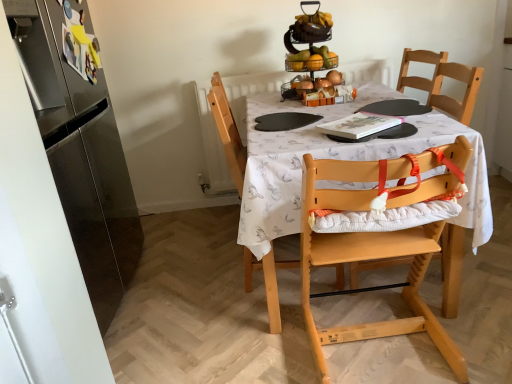
Question: Is light wood highchair at center, which is the second chair in front-to-back order, closer to the viewer compared to light wood highchair at center, positioned as the 2th chair in back-to-front order?

Choices:
 (A) no
 (B) yes

Answer: (A)

Question: Can you confirm if light wood highchair at center, which is the second chair in front-to-back order, is bigger than light wood highchair at center, the first chair in the front-to-back sequence?

Choices:
 (A) no
 (B) yes

Answer: (B)

Question: Considering the relative sizes of light wood highchair at center, the first chair in the back-to-front sequence, and light wood highchair at center, the first chair in the front-to-back sequence, in the image provided, is light wood highchair at center, the first chair in the back-to-front sequence, taller than light wood highchair at center, the first chair in the front-to-back sequence,?

Choices:
 (A) yes
 (B) no

Answer: (A)

Question: From a real-world perspective, is light wood highchair at center, the first chair in the back-to-front sequence, located beneath light wood highchair at center, positioned as the 2th chair in back-to-front order?

Choices:
 (A) yes
 (B) no

Answer: (B)

Question: Does light wood highchair at center, which is the second chair in front-to-back order, appear on the right side of light wood highchair at center, the first chair in the front-to-back sequence?

Choices:
 (A) yes
 (B) no

Answer: (B)

Question: Would you say light wood highchair at center, which is the second chair in front-to-back order, contains light wood highchair at center, positioned as the 2th chair in back-to-front order?

Choices:
 (A) yes
 (B) no

Answer: (B)

Question: Considering the relative sizes of light wood highchair at center, the first chair in the front-to-back sequence, and satin silver refrigerator at left in the image provided, is light wood highchair at center, the first chair in the front-to-back sequence, wider than satin silver refrigerator at left?

Choices:
 (A) no
 (B) yes

Answer: (B)

Question: Is light wood highchair at center, the first chair in the front-to-back sequence, not near satin silver refrigerator at left?

Choices:
 (A) no
 (B) yes

Answer: (B)

Question: Does light wood highchair at center, positioned as the 2th chair in back-to-front order, appear on the left side of satin silver refrigerator at left?

Choices:
 (A) no
 (B) yes

Answer: (A)

Question: From the image's perspective, does light wood highchair at center, the first chair in the front-to-back sequence, appear lower than satin silver refrigerator at left?

Choices:
 (A) no
 (B) yes

Answer: (B)

Question: Can you confirm if light wood highchair at center, positioned as the 2th chair in back-to-front order, is bigger than satin silver refrigerator at left?

Choices:
 (A) no
 (B) yes

Answer: (A)

Question: Considering the relative sizes of light wood highchair at center, positioned as the 2th chair in back-to-front order, and satin silver refrigerator at left in the image provided, is light wood highchair at center, positioned as the 2th chair in back-to-front order, thinner than satin silver refrigerator at left?

Choices:
 (A) no
 (B) yes

Answer: (A)

Question: Is light wood highchair at center, positioned as the 2th chair in back-to-front order, oriented away from wooden high chair at center?

Choices:
 (A) yes
 (B) no

Answer: (B)